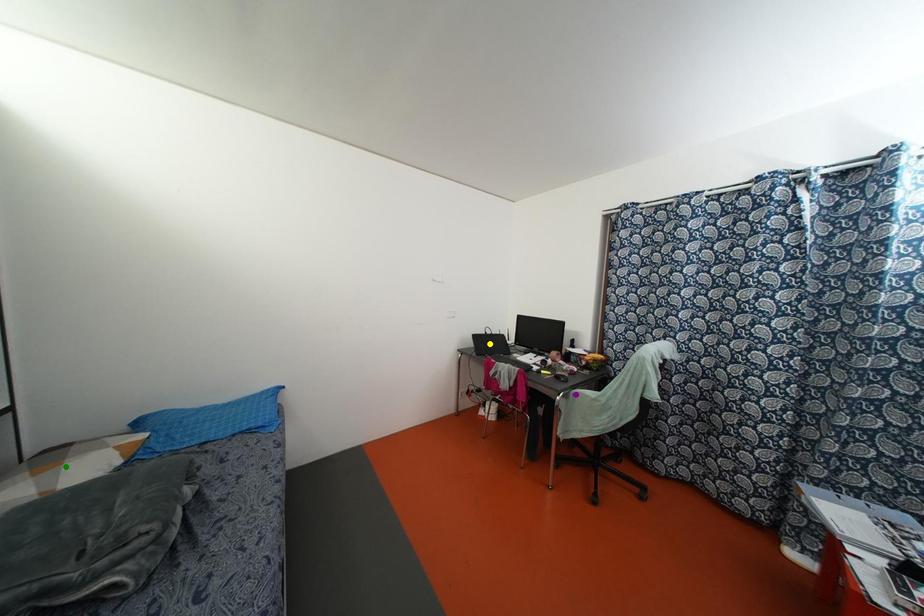
Order these from nearest to farthest:
green point | yellow point | purple point

1. green point
2. purple point
3. yellow point